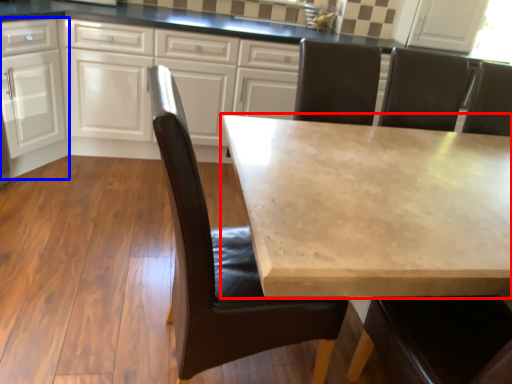
Question: Which object appears closest to the camera in this image, table (highlighted by a red box) or cabinetry (highlighted by a blue box)?

Choices:
 (A) table
 (B) cabinetry

Answer: (A)